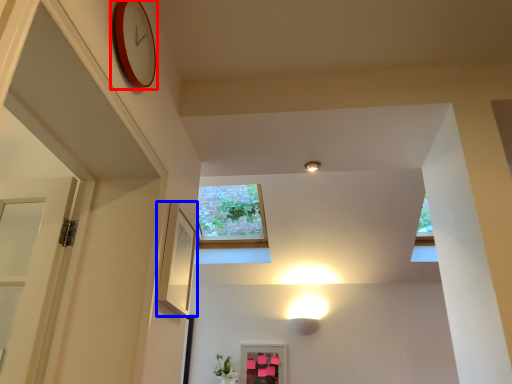
Question: Among these objects, which one is nearest to the camera, clock (highlighted by a red box) or picture frame (highlighted by a blue box)?

Choices:
 (A) clock
 (B) picture frame

Answer: (A)